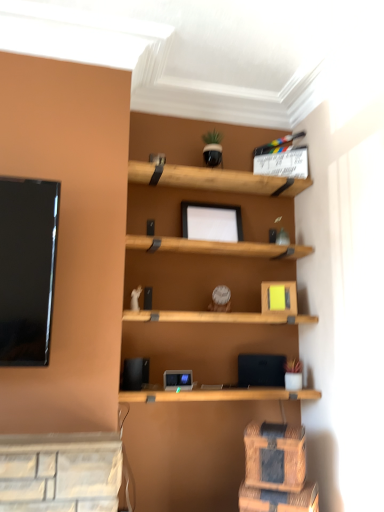
At what (x,y) coordinates should I click in order to perform the action: click on woven wood drawer at lower right, acting as the 2th drawer starting from the bottom. Please return your answer as a coordinate pair (x, y). Looking at the image, I should click on (275, 456).

What do you see at coordinates (275, 456) in the screenshot? I see `woven wood drawer at lower right, the 1th drawer positioned from the top` at bounding box center [275, 456].

Where is `blue fabric drawer at lower right, positioned as the 2th drawer in top-to-bottom order`? blue fabric drawer at lower right, positioned as the 2th drawer in top-to-bottom order is located at coordinates (278, 499).

What do you see at coordinates (278, 499) in the screenshot?
I see `blue fabric drawer at lower right, the first drawer ordered from the bottom` at bounding box center [278, 499].

How much space does blue fabric drawer at lower right, positioned as the 2th drawer in top-to-bottom order, occupy horizontally?

blue fabric drawer at lower right, positioned as the 2th drawer in top-to-bottom order, is 9.73 inches in width.

At what (x,y) coordinates should I click in order to perform the action: click on woven wood drawer at lower right, the 1th drawer positioned from the top. Please return your answer as a coordinate pair (x, y). The image size is (384, 512). Looking at the image, I should click on (275, 456).

Is woven wood drawer at lower right, acting as the 2th drawer starting from the bottom, to the left of blue fabric drawer at lower right, the first drawer ordered from the bottom, from the viewer's perspective?

Yes, woven wood drawer at lower right, acting as the 2th drawer starting from the bottom, is to the left of blue fabric drawer at lower right, the first drawer ordered from the bottom.

Is woven wood drawer at lower right, the 1th drawer positioned from the top, positioned behind blue fabric drawer at lower right, positioned as the 2th drawer in top-to-bottom order?

Yes.

Is point (275, 453) farther from camera compared to point (272, 503)?

Yes, it is behind point (272, 503).

From the image's perspective, between woven wood drawer at lower right, the 1th drawer positioned from the top, and blue fabric drawer at lower right, the first drawer ordered from the bottom, which one is located above?

woven wood drawer at lower right, the 1th drawer positioned from the top, appears higher in the image.

From a real-world perspective, which is physically below, woven wood drawer at lower right, the 1th drawer positioned from the top, or blue fabric drawer at lower right, positioned as the 2th drawer in top-to-bottom order?

blue fabric drawer at lower right, positioned as the 2th drawer in top-to-bottom order, from a real-world perspective.

Considering the sizes of objects woven wood drawer at lower right, acting as the 2th drawer starting from the bottom, and blue fabric drawer at lower right, the first drawer ordered from the bottom, in the image provided, who is wider, woven wood drawer at lower right, acting as the 2th drawer starting from the bottom, or blue fabric drawer at lower right, the first drawer ordered from the bottom,?

With larger width is blue fabric drawer at lower right, the first drawer ordered from the bottom.

Between woven wood drawer at lower right, the 1th drawer positioned from the top, and blue fabric drawer at lower right, positioned as the 2th drawer in top-to-bottom order, which one has less height?

blue fabric drawer at lower right, positioned as the 2th drawer in top-to-bottom order.

Between woven wood drawer at lower right, the 1th drawer positioned from the top, and blue fabric drawer at lower right, the first drawer ordered from the bottom, which one has larger size?

Bigger between the two is blue fabric drawer at lower right, the first drawer ordered from the bottom.

Do you think woven wood drawer at lower right, acting as the 2th drawer starting from the bottom, is within blue fabric drawer at lower right, positioned as the 2th drawer in top-to-bottom order, or outside of it?

woven wood drawer at lower right, acting as the 2th drawer starting from the bottom, is spatially situated outside blue fabric drawer at lower right, positioned as the 2th drawer in top-to-bottom order.

Is woven wood drawer at lower right, acting as the 2th drawer starting from the bottom, far from blue fabric drawer at lower right, positioned as the 2th drawer in top-to-bottom order?

woven wood drawer at lower right, acting as the 2th drawer starting from the bottom, is actually quite close to blue fabric drawer at lower right, positioned as the 2th drawer in top-to-bottom order.

Is woven wood drawer at lower right, acting as the 2th drawer starting from the bottom, oriented towards blue fabric drawer at lower right, the first drawer ordered from the bottom?

No, woven wood drawer at lower right, acting as the 2th drawer starting from the bottom, is not oriented towards blue fabric drawer at lower right, the first drawer ordered from the bottom.

Locate an element on the screen. drawer below the woven wood drawer at lower right, acting as the 2th drawer starting from the bottom (from the image's perspective) is located at coordinates (278, 499).

Is blue fabric drawer at lower right, the first drawer ordered from the bottom, at the left side of woven wood drawer at lower right, acting as the 2th drawer starting from the bottom?

No, blue fabric drawer at lower right, the first drawer ordered from the bottom, is not to the left of woven wood drawer at lower right, acting as the 2th drawer starting from the bottom.

Which object is closer to the camera taking this photo, blue fabric drawer at lower right, positioned as the 2th drawer in top-to-bottom order, or woven wood drawer at lower right, the 1th drawer positioned from the top?

blue fabric drawer at lower right, positioned as the 2th drawer in top-to-bottom order.

Is point (274, 504) positioned after point (260, 453)?

No, (274, 504) is closer to viewer.

From the image's perspective, is blue fabric drawer at lower right, positioned as the 2th drawer in top-to-bottom order, under woven wood drawer at lower right, acting as the 2th drawer starting from the bottom?

Yes, from the image's perspective, blue fabric drawer at lower right, positioned as the 2th drawer in top-to-bottom order, is below woven wood drawer at lower right, acting as the 2th drawer starting from the bottom.

From a real-world perspective, is blue fabric drawer at lower right, the first drawer ordered from the bottom, physically below woven wood drawer at lower right, the 1th drawer positioned from the top?

Yes.

Does blue fabric drawer at lower right, the first drawer ordered from the bottom, have a greater width compared to woven wood drawer at lower right, the 1th drawer positioned from the top?

Indeed, blue fabric drawer at lower right, the first drawer ordered from the bottom, has a greater width compared to woven wood drawer at lower right, the 1th drawer positioned from the top.

Considering the sizes of blue fabric drawer at lower right, positioned as the 2th drawer in top-to-bottom order, and woven wood drawer at lower right, the 1th drawer positioned from the top, in the image, is blue fabric drawer at lower right, positioned as the 2th drawer in top-to-bottom order, taller or shorter than woven wood drawer at lower right, the 1th drawer positioned from the top,?

Clearly, blue fabric drawer at lower right, positioned as the 2th drawer in top-to-bottom order, is shorter compared to woven wood drawer at lower right, the 1th drawer positioned from the top.

Which of these two, blue fabric drawer at lower right, positioned as the 2th drawer in top-to-bottom order, or woven wood drawer at lower right, the 1th drawer positioned from the top, is bigger?

Bigger between the two is blue fabric drawer at lower right, positioned as the 2th drawer in top-to-bottom order.

Would you say blue fabric drawer at lower right, positioned as the 2th drawer in top-to-bottom order, contains woven wood drawer at lower right, the 1th drawer positioned from the top?

Actually, woven wood drawer at lower right, the 1th drawer positioned from the top, is outside blue fabric drawer at lower right, positioned as the 2th drawer in top-to-bottom order.

Is blue fabric drawer at lower right, positioned as the 2th drawer in top-to-bottom order, not close to woven wood drawer at lower right, the 1th drawer positioned from the top?

That's not correct — blue fabric drawer at lower right, positioned as the 2th drawer in top-to-bottom order, is a little close to woven wood drawer at lower right, the 1th drawer positioned from the top.

Is blue fabric drawer at lower right, the first drawer ordered from the bottom, facing towards woven wood drawer at lower right, acting as the 2th drawer starting from the bottom?

No, blue fabric drawer at lower right, the first drawer ordered from the bottom, is not turned towards woven wood drawer at lower right, acting as the 2th drawer starting from the bottom.

How many degrees apart are the facing directions of blue fabric drawer at lower right, positioned as the 2th drawer in top-to-bottom order, and woven wood drawer at lower right, the 1th drawer positioned from the top?

blue fabric drawer at lower right, positioned as the 2th drawer in top-to-bottom order, and woven wood drawer at lower right, the 1th drawer positioned from the top, are facing 4.59 degrees away from each other.

How distant is blue fabric drawer at lower right, the first drawer ordered from the bottom, from woven wood drawer at lower right, acting as the 2th drawer starting from the bottom?

They are 4.51 inches apart.

The width and height of the screenshot is (384, 512). I want to click on drawer above the blue fabric drawer at lower right, the first drawer ordered from the bottom (from the image's perspective), so click(275, 456).

I want to click on drawer above the blue fabric drawer at lower right, positioned as the 2th drawer in top-to-bottom order (from the image's perspective), so click(275, 456).

This screenshot has height=512, width=384. Identify the location of drawer above the blue fabric drawer at lower right, the first drawer ordered from the bottom (from a real-world perspective). (275, 456).